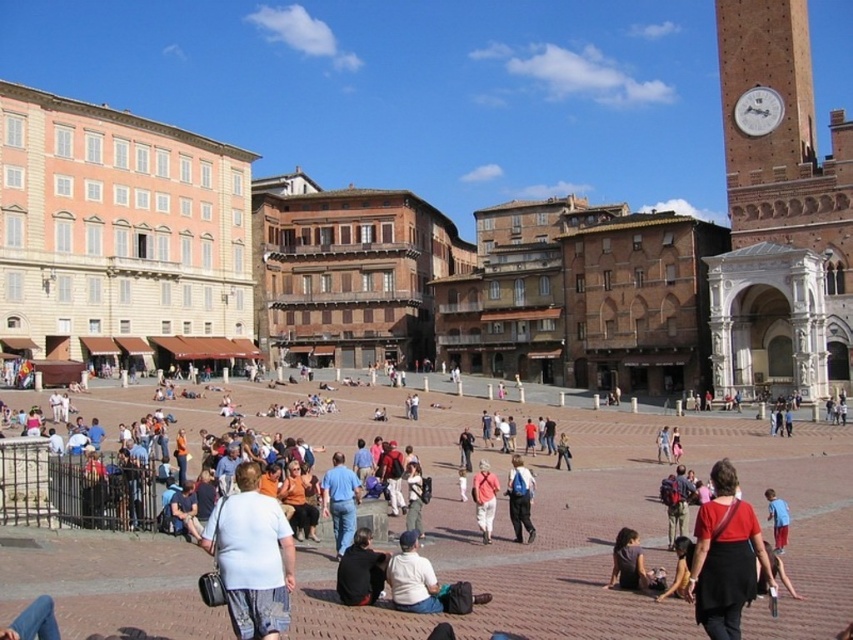
You are a photographer standing in the square and want to capture both the light blue cotton shirt at center and the dark gray fabric shirt at lower center in your photo. Based on their heights, which one might appear larger in the photo?

The light blue cotton shirt at center is much taller than the dark gray fabric shirt at lower center, so it will appear larger in the photo.

You are a tourist in the square and want to take a photo of the brown brick clock tower at upper right while also including the matte blue backpack at center in the frame. Since the clock tower is larger, will you need to move closer to or farther away from the clock tower to ensure both fit in the photo?

The brown brick clock tower at upper right is larger than the matte blue backpack at center. To include both in the photo, you should move closer to the clock tower so that its size relative to the backpack is balanced in the frame.

You are standing in the square and want to place your matte blue backpack at center so that it is visible from the brown brick clock tower at upper right. Should you move it forward or backward?

The matte blue backpack at center is currently behind the brown brick clock tower at upper right, so to make it visible from the clock tower, you should move it forward closer to the tower.